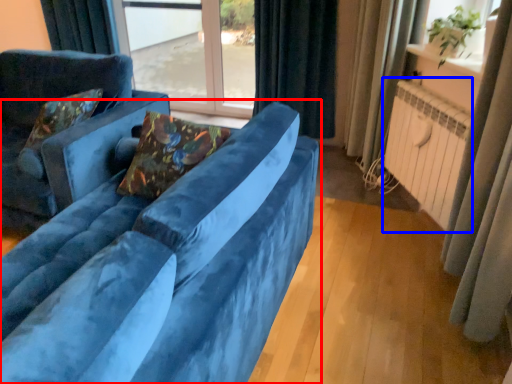
Question: Among these objects, which one is farthest to the camera, studio couch (highlighted by a red box) or radiator (highlighted by a blue box)?

Choices:
 (A) studio couch
 (B) radiator

Answer: (B)